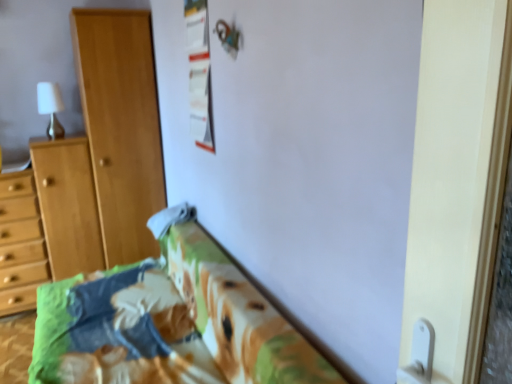
Question: Looking at the image, does white glossy screen door at right seem bigger or smaller compared to light wood dresser at left?

Choices:
 (A) big
 (B) small

Answer: (B)

Question: Does point pos(435,238) appear closer or farther from the camera than point pos(24,236)?

Choices:
 (A) closer
 (B) farther

Answer: (A)

Question: Which object is the farthest from the white glossy screen door at right?

Choices:
 (A) white matte lamp at upper left
 (B) white fabric pillow at lower center
 (C) printed fabric bedspread at lower center
 (D) light wood dresser at left
 (E) light brown wooden cupboard at left

Answer: (A)

Question: Which object is positioned closest to the light brown wooden cupboard at left?

Choices:
 (A) printed fabric bedspread at lower center
 (B) white matte lamp at upper left
 (C) light wood dresser at left
 (D) white fabric pillow at lower center
 (E) white glossy screen door at right

Answer: (C)